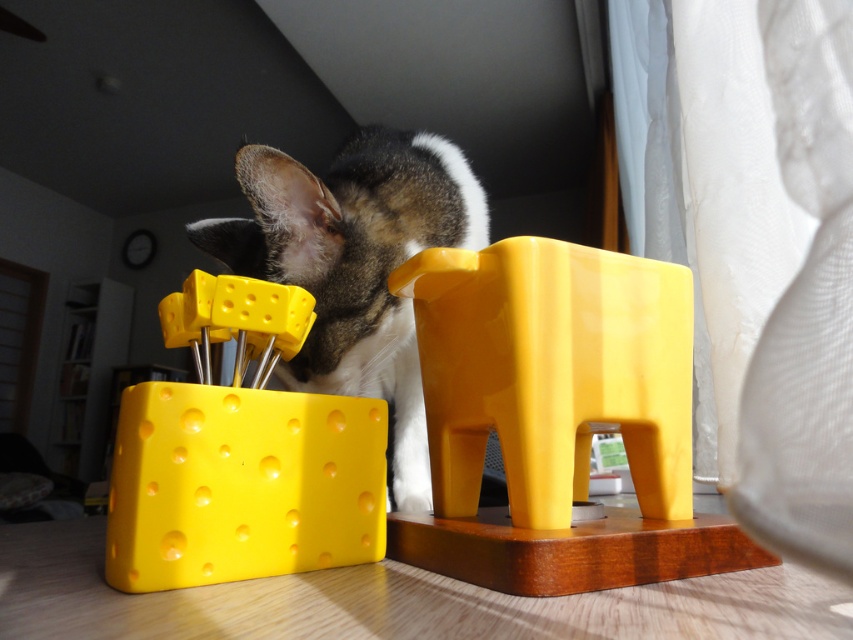
Who is higher up, matte plastic cheese at left or fluffy fur cat at center?

fluffy fur cat at center is higher up.

Does matte plastic cheese at left appear over fluffy fur cat at center?

No, matte plastic cheese at left is not above fluffy fur cat at center.

Image resolution: width=853 pixels, height=640 pixels. What do you see at coordinates (241, 454) in the screenshot? I see `matte plastic cheese at left` at bounding box center [241, 454].

Where is `matte plastic cheese at left`? This screenshot has height=640, width=853. matte plastic cheese at left is located at coordinates (241, 454).

Does point (662, 548) lie behind point (373, 451)?

That is False.

Can you confirm if yellow plastic elephant at center is positioned below matte plastic cheese at left?

Correct, yellow plastic elephant at center is located below matte plastic cheese at left.

Is point (416, 333) in front of point (183, 326)?

No, it is behind (183, 326).

Find the location of `yellow plastic elephant at center`. yellow plastic elephant at center is located at coordinates (556, 417).

Does yellow plastic elephant at center come in front of fluffy fur cat at center?

Yes, it is.

Which is in front, point (524, 346) or point (282, 269)?

Positioned in front is point (524, 346).

The height and width of the screenshot is (640, 853). What are the coordinates of `yellow plastic elephant at center` in the screenshot? It's located at (556, 417).